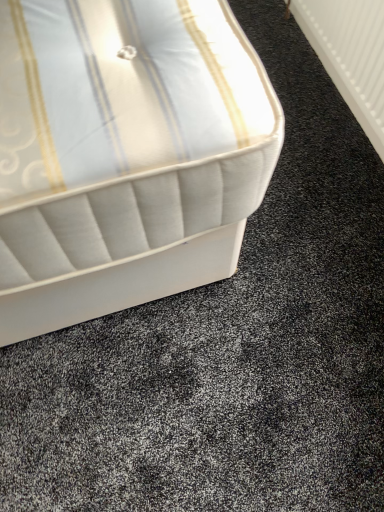
The image size is (384, 512). What are the coordinates of `vacant location below white plastic radiator at upper right (from a real-world perspective)` in the screenshot? It's located at (331, 106).